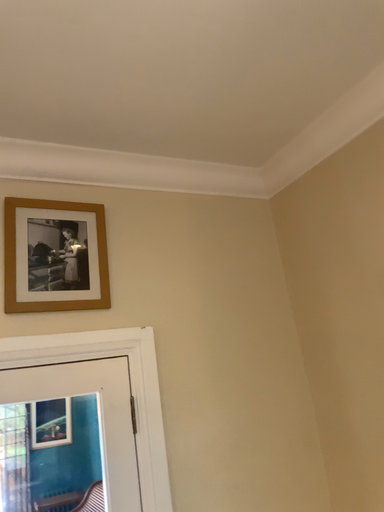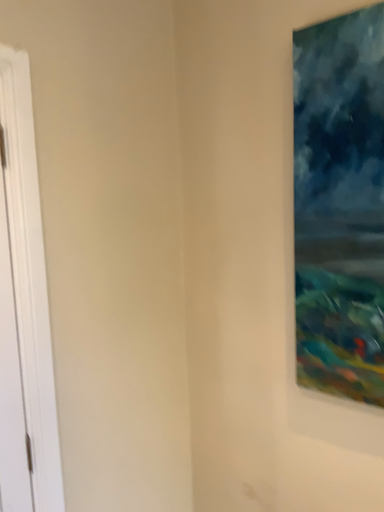
Question: Which way did the camera rotate in the video?

Choices:
 (A) rotated downward
 (B) rotated upward

Answer: (A)